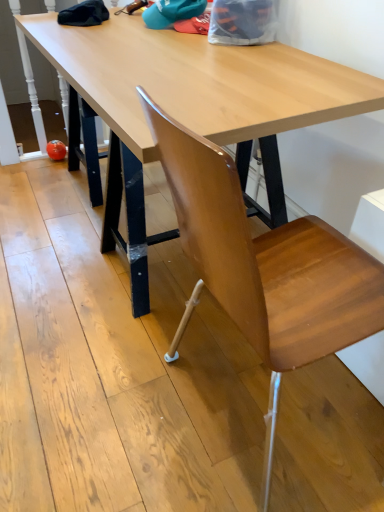
Where is `vacant space situated on the left part of wooden chair at center`? This screenshot has width=384, height=512. vacant space situated on the left part of wooden chair at center is located at coordinates (93, 384).